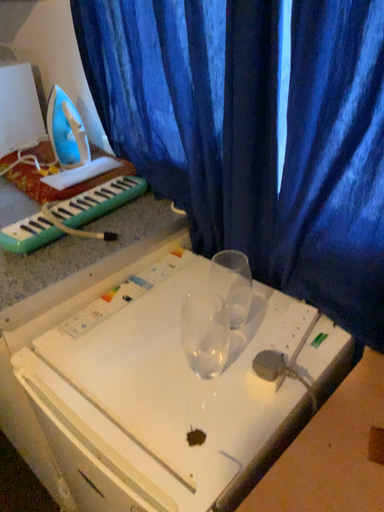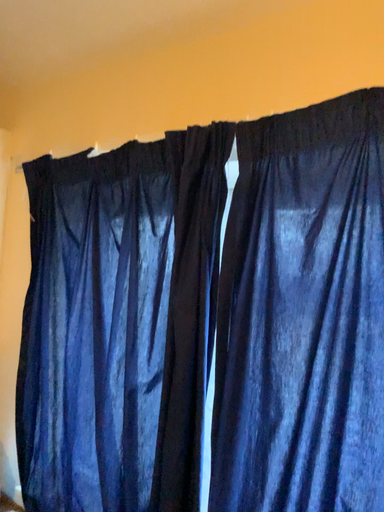
Question: How did the camera likely rotate when shooting the video?

Choices:
 (A) rotated downward
 (B) rotated upward

Answer: (B)